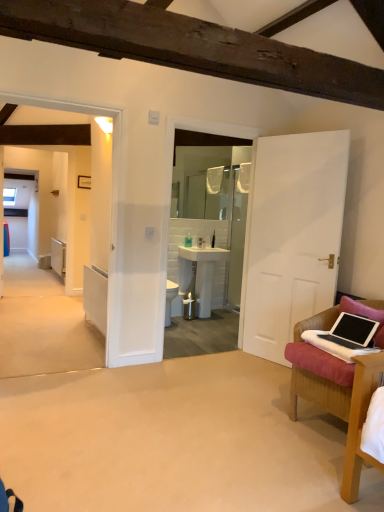
Question: From the image's perspective, is pink fabric pillow at right on metallic silver trash can at center?

Choices:
 (A) yes
 (B) no

Answer: (A)

Question: From a real-world perspective, does pink fabric pillow at right stand above metallic silver trash can at center?

Choices:
 (A) no
 (B) yes

Answer: (B)

Question: Can you confirm if pink fabric pillow at right is smaller than metallic silver trash can at center?

Choices:
 (A) yes
 (B) no

Answer: (B)

Question: Is pink fabric pillow at right to the left of metallic silver trash can at center from the viewer's perspective?

Choices:
 (A) yes
 (B) no

Answer: (B)

Question: Are pink fabric pillow at right and metallic silver trash can at center far apart?

Choices:
 (A) yes
 (B) no

Answer: (A)

Question: Is pink fabric pillow at right not inside metallic silver trash can at center?

Choices:
 (A) no
 (B) yes

Answer: (B)

Question: Would you say wooden picture frame at upper center is a long distance from metallic silver trash can at center?

Choices:
 (A) yes
 (B) no

Answer: (A)

Question: Considering the relative sizes of wooden picture frame at upper center and metallic silver trash can at center in the image provided, is wooden picture frame at upper center thinner than metallic silver trash can at center?

Choices:
 (A) yes
 (B) no

Answer: (A)

Question: Is the position of wooden picture frame at upper center more distant than that of metallic silver trash can at center?

Choices:
 (A) yes
 (B) no

Answer: (A)

Question: From the image's perspective, is wooden picture frame at upper center under metallic silver trash can at center?

Choices:
 (A) yes
 (B) no

Answer: (B)

Question: Considering the relative sizes of wooden picture frame at upper center and metallic silver trash can at center in the image provided, is wooden picture frame at upper center shorter than metallic silver trash can at center?

Choices:
 (A) yes
 (B) no

Answer: (A)

Question: From the image's perspective, is wooden picture frame at upper center located above metallic silver trash can at center?

Choices:
 (A) yes
 (B) no

Answer: (A)

Question: Can you confirm if translucent plastic bottle at center is smaller than pink fabric pillow at right?

Choices:
 (A) no
 (B) yes

Answer: (B)